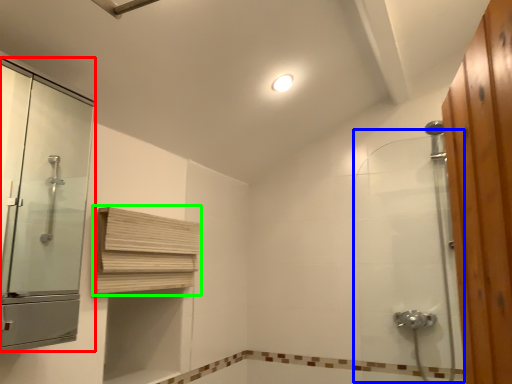
Question: Which is nearer to the screen door (highlighted by a red box)? shower door (highlighted by a blue box) or shelf (highlighted by a green box).

Choices:
 (A) shower door
 (B) shelf

Answer: (B)